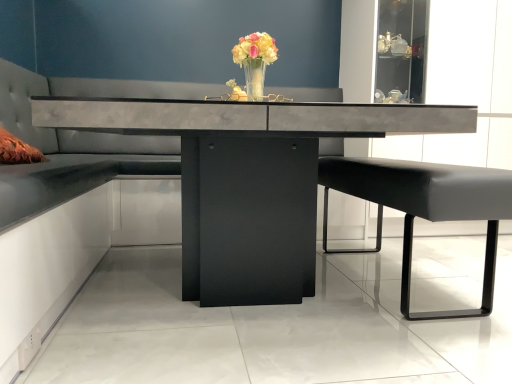
Describe the element at coordinates (249, 179) in the screenshot. Image resolution: width=512 pixels, height=384 pixels. I see `concrete table at center` at that location.

Find the location of `black leather bench at right`. black leather bench at right is located at coordinates (424, 208).

Locate an element on the screen. This screenshot has width=512, height=384. tufted leather couch at center is located at coordinates (76, 142).

Measure the distance between tufted leather couch at center and camera.

tufted leather couch at center and camera are 95.90 centimeters apart from each other.

Locate an element on the screen. concrete table at center is located at coordinates (249, 179).

Is black leather bench at right facing away from translucent glass vase at center?

That's not correct — black leather bench at right is not looking away from translucent glass vase at center.

Is black leather bench at right bigger or smaller than translucent glass vase at center?

Considering their sizes, black leather bench at right takes up more space than translucent glass vase at center.

Is black leather bench at right at the left side of translucent glass vase at center?

In fact, black leather bench at right is to the right of translucent glass vase at center.

Is black leather bench at right positioned far away from tufted leather couch at center?

That's right, there is a large distance between black leather bench at right and tufted leather couch at center.

Could you tell me if black leather bench at right is facing tufted leather couch at center?

Yes, black leather bench at right faces towards tufted leather couch at center.

From a real-world perspective, relative to tufted leather couch at center, is black leather bench at right vertically above or below?

From a real-world perspective, black leather bench at right is physically below tufted leather couch at center.

Consider the image. Considering the sizes of tufted leather couch at center and concrete table at center in the image, is tufted leather couch at center wider or thinner than concrete table at center?

Considering their sizes, tufted leather couch at center looks slimmer than concrete table at center.

What's the angular difference between tufted leather couch at center and concrete table at center's facing directions?

tufted leather couch at center and concrete table at center are facing 87.4 degrees away from each other.

From a real-world perspective, is tufted leather couch at center positioned under concrete table at center based on gravity?

No.

Considering the points (12, 206) and (208, 111), which point is behind, point (12, 206) or point (208, 111)?

The point (208, 111) is farther from the camera.

Is translucent glass vase at center looking in the opposite direction of concrete table at center?

No, translucent glass vase at center is not facing the opposite direction of concrete table at center.

Which is more to the left, translucent glass vase at center or concrete table at center?

Positioned to the left is concrete table at center.

Image resolution: width=512 pixels, height=384 pixels. In the image, there is a concrete table at center. What are the coordinates of `floral arrangement above it (from the image's perspective)` in the screenshot? It's located at (255, 61).

Between concrete table at center and translucent glass vase at center, which one has smaller size?

Smaller between the two is translucent glass vase at center.

Looking at this image, in terms of height, does concrete table at center look taller or shorter compared to translucent glass vase at center?

Considering their sizes, concrete table at center has more height than translucent glass vase at center.

Would you say concrete table at center is inside or outside translucent glass vase at center?

concrete table at center cannot be found inside translucent glass vase at center.

Does point (168, 128) come farther from viewer compared to point (253, 43)?

No.

Are translucent glass vase at center and tufted leather couch at center making contact?

translucent glass vase at center and tufted leather couch at center are clearly separated.

Can you confirm if translucent glass vase at center is positioned to the left of tufted leather couch at center?

In fact, translucent glass vase at center is to the right of tufted leather couch at center.

Is the depth of translucent glass vase at center less than that of tufted leather couch at center?

That is True.

Considering the sizes of translucent glass vase at center and tufted leather couch at center in the image, is translucent glass vase at center wider or thinner than tufted leather couch at center?

In the image, translucent glass vase at center appears to be more narrow than tufted leather couch at center.

Would you say translucent glass vase at center is inside or outside black leather bench at right?

translucent glass vase at center is outside black leather bench at right.

Is translucent glass vase at center shorter than black leather bench at right?

Yes.

From the image's perspective, which one is positioned lower, translucent glass vase at center or black leather bench at right?

black leather bench at right appears lower in the image.

Does translucent glass vase at center have a greater width compared to black leather bench at right?

In fact, translucent glass vase at center might be narrower than black leather bench at right.

You are a GUI agent. You are given a task and a screenshot of the screen. Output one action in this format:
    pyautogui.click(x=<x>, y=<y>)
    Task: Click on the floral arrangement above the black leather bench at right (from the image's perspective)
    
    Given the screenshot: What is the action you would take?
    pyautogui.click(x=255, y=61)

Identify the location of swivel chair below the tufted leather couch at center (from a real-world perspective). (424, 208).

From the picture: Estimate the real-world distances between objects in this image. Which object is further from black leather bench at right, translucent glass vase at center or tufted leather couch at center?

tufted leather couch at center lies further to black leather bench at right than the other object.

Considering their positions, is tufted leather couch at center positioned closer to concrete table at center than translucent glass vase at center?

The object closer to concrete table at center is translucent glass vase at center.

Based on their spatial positions, is black leather bench at right or translucent glass vase at center closer to tufted leather couch at center?

The object closer to tufted leather couch at center is translucent glass vase at center.

From the image, which object appears to be nearer to tufted leather couch at center, concrete table at center or black leather bench at right?

concrete table at center.

Consider the image. Estimate the real-world distances between objects in this image. Which object is closer to translucent glass vase at center, tufted leather couch at center or concrete table at center?

concrete table at center is positioned closer to the anchor translucent glass vase at center.

Consider the image. Looking at the image, which one is located closer to tufted leather couch at center, translucent glass vase at center or concrete table at center?

Based on the image, concrete table at center appears to be nearer to tufted leather couch at center.

Which object lies nearer to the anchor point black leather bench at right, concrete table at center or tufted leather couch at center?

The object closer to black leather bench at right is concrete table at center.

Looking at the image, which one is located further to black leather bench at right, translucent glass vase at center or concrete table at center?

The object further to black leather bench at right is translucent glass vase at center.

This screenshot has width=512, height=384. In order to click on floral arrangement between concrete table at center and black leather bench at right from left to right in this screenshot , I will do `click(255, 61)`.

You are a GUI agent. You are given a task and a screenshot of the screen. Output one action in this format:
    pyautogui.click(x=<x>, y=<y>)
    Task: Click on the floral arrangement between concrete table at center and tufted leather couch at center from front to back
    
    Given the screenshot: What is the action you would take?
    pyautogui.click(x=255, y=61)

I want to click on floral arrangement positioned between black leather bench at right and tufted leather couch at center from near to far, so click(255, 61).

Identify the location of swivel chair between concrete table at center and tufted leather couch at center along the z-axis. (424, 208).